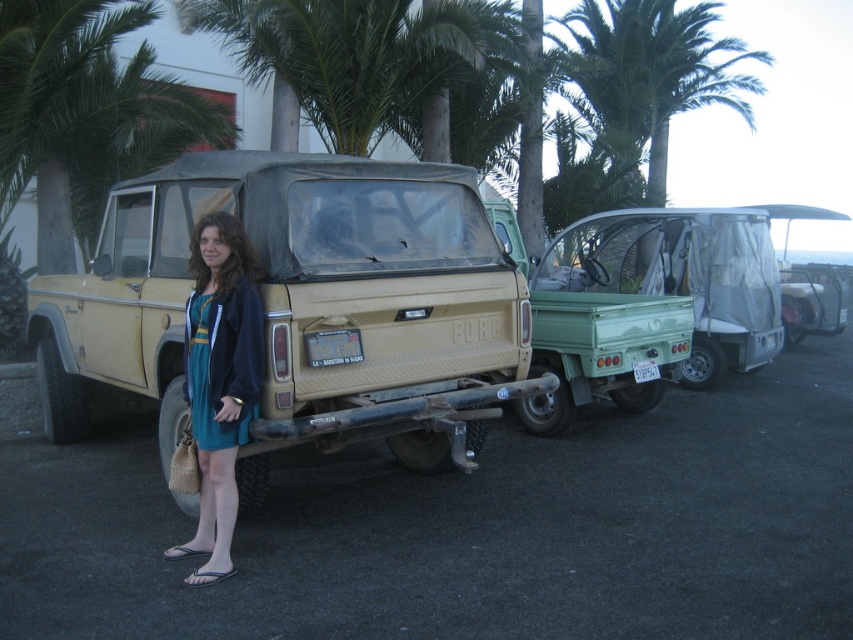
You are standing in front of the vintage Ford truck and want to determine the relative positions of two points marked on the truck. The first point is at coordinates point [593,273] and the second is at point [648,380]. Which point is closer to you?

Point [593,273] is further to the viewer than point [648,380], so the second point is closer to you.

In the scene shown: You are a delivery person needing to place a package between the teal fabric dress at center and the white plastic license plate at rear. Can you fit the package in the space between them if it requires 3.5 meters of space?

The distance between the teal fabric dress at center and the white plastic license plate at rear is 4.05 meters, so yes, the package requiring 3.5 meters of space can fit in the available space.